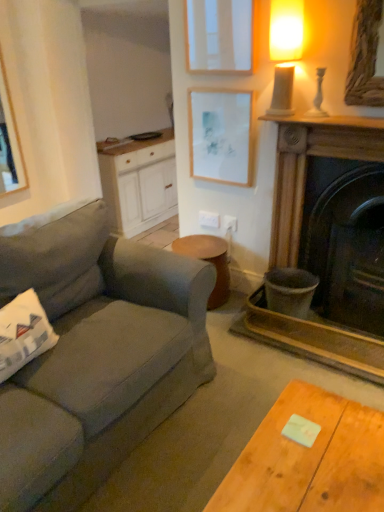
This screenshot has height=512, width=384. What do you see at coordinates (209, 219) in the screenshot?
I see `white plastic power outlet at center, the second power outlet from the right` at bounding box center [209, 219].

From the picture: In order to face white wood cabinet at center, should I rotate leftwards or rightwards?

Turn left approximately 5.364 degrees to face it.

Describe the element at coordinates (139, 183) in the screenshot. I see `white wood cabinet at center` at that location.

The width and height of the screenshot is (384, 512). What do you see at coordinates (209, 262) in the screenshot?
I see `wooden stool at center` at bounding box center [209, 262].

What is the approximate height of dark brown wood fireplace at right?

The height of dark brown wood fireplace at right is 1.08 meters.

Describe the element at coordinates (229, 223) in the screenshot. I see `white plastic power outlet at center, the second power outlet in the left-to-right sequence` at that location.

Find the location of a particular element. This screenshot has height=512, width=384. white plastic power outlet at center, marked as the first power outlet in a right-to-left arrangement is located at coordinates (229, 223).

Locate an element on the screen. Image resolution: width=384 pixels, height=512 pixels. matte white picture frame at upper center, which ranks as the 1th picture frame in bottom-to-top order is located at coordinates [220, 135].

The width and height of the screenshot is (384, 512). Describe the element at coordinates (220, 135) in the screenshot. I see `matte white picture frame at upper center, which ranks as the 1th picture frame in bottom-to-top order` at that location.

This screenshot has width=384, height=512. What are the coordinates of `matte gray fabric couch at left` in the screenshot? It's located at [101, 362].

Is white plastic power outlet at center, the second power outlet in the left-to-right sequence, looking in the opposite direction of dark brown wood fireplace at right?

white plastic power outlet at center, the second power outlet in the left-to-right sequence, is not turned away from dark brown wood fireplace at right.

From a real-world perspective, is white plastic power outlet at center, marked as the first power outlet in a right-to-left arrangement, physically below dark brown wood fireplace at right?

Yes, from a real-world perspective, white plastic power outlet at center, marked as the first power outlet in a right-to-left arrangement, is under dark brown wood fireplace at right.

Could you measure the distance between white plastic power outlet at center, marked as the first power outlet in a right-to-left arrangement, and dark brown wood fireplace at right?

They are 26.56 inches apart.

Is there a large distance between white plastic power outlet at center, marked as the first power outlet in a right-to-left arrangement, and dark brown wood fireplace at right?

No.

Consider the image. Which object is more forward, wooden stool at center or dark brown wood fireplace at right?

dark brown wood fireplace at right is more forward.

Which is in front, point (202, 256) or point (302, 164)?

The point (302, 164) is more forward.

Is there a large distance between wooden stool at center and dark brown wood fireplace at right?

That's not correct — wooden stool at center is a little close to dark brown wood fireplace at right.

In the scene shown: Looking at their sizes, would you say wooden stool at center is wider or thinner than dark brown wood fireplace at right?

In the image, wooden stool at center appears to be wider than dark brown wood fireplace at right.

From the image's perspective, is white plastic power outlet at center, marked as the first power outlet in a right-to-left arrangement, positioned above or below white plastic power outlet at center, the 1th power outlet when ordered from left to right?

white plastic power outlet at center, marked as the first power outlet in a right-to-left arrangement, is below white plastic power outlet at center, the 1th power outlet when ordered from left to right.

Considering the relative sizes of white plastic power outlet at center, marked as the first power outlet in a right-to-left arrangement, and white plastic power outlet at center, the second power outlet from the right, in the image provided, is white plastic power outlet at center, marked as the first power outlet in a right-to-left arrangement, wider than white plastic power outlet at center, the second power outlet from the right,?

Incorrect, the width of white plastic power outlet at center, marked as the first power outlet in a right-to-left arrangement, does not surpass that of white plastic power outlet at center, the second power outlet from the right.

Does white plastic power outlet at center, the second power outlet in the left-to-right sequence, have a larger size compared to white plastic power outlet at center, the 1th power outlet when ordered from left to right?

No, white plastic power outlet at center, the second power outlet in the left-to-right sequence, is not bigger than white plastic power outlet at center, the 1th power outlet when ordered from left to right.

Does white plastic power outlet at center, marked as the first power outlet in a right-to-left arrangement, appear on the right side of white plastic power outlet at center, the 1th power outlet when ordered from left to right?

Indeed, white plastic power outlet at center, marked as the first power outlet in a right-to-left arrangement, is positioned on the right side of white plastic power outlet at center, the 1th power outlet when ordered from left to right.

Can you confirm if matte gray fabric couch at left is bigger than dark brown wood fireplace at right?

Correct, matte gray fabric couch at left is larger in size than dark brown wood fireplace at right.

From the image's perspective, does matte gray fabric couch at left appear lower than dark brown wood fireplace at right?

Yes.

Is matte gray fabric couch at left with dark brown wood fireplace at right?

No.

How different are the orientations of matte gray fabric couch at left and dark brown wood fireplace at right in degrees?

90 degrees separate the facing orientations of matte gray fabric couch at left and dark brown wood fireplace at right.

Is the depth of matte white picture frame at upper center, which ranks as the 1th picture frame in bottom-to-top order, less than that of dark brown wood fireplace at right?

No, it is not.

Which is behind, point (226, 154) or point (289, 248)?

Point (226, 154)

Is dark brown wood fireplace at right at the back of matte white picture frame at upper center, which ranks as the 2th picture frame in top-to-bottom order?

No.

Who is taller, matte white picture frame at upper center, which ranks as the 2th picture frame in top-to-bottom order, or dark brown wood fireplace at right?

Standing taller between the two is dark brown wood fireplace at right.

Which is behind, point (144, 210) or point (228, 216)?

Positioned behind is point (144, 210).

Where is `the 2nd power outlet to the right of the white wood cabinet at center, starting your count from the anchor`? The width and height of the screenshot is (384, 512). the 2nd power outlet to the right of the white wood cabinet at center, starting your count from the anchor is located at coordinates (229, 223).

From a real-world perspective, relative to white plastic power outlet at center, the second power outlet in the left-to-right sequence, is white wood cabinet at center vertically above or below?

From a real-world perspective, white wood cabinet at center is physically below white plastic power outlet at center, the second power outlet in the left-to-right sequence.

In terms of height, does white wood cabinet at center look taller or shorter compared to white plastic power outlet at center, marked as the first power outlet in a right-to-left arrangement?

white wood cabinet at center is taller than white plastic power outlet at center, marked as the first power outlet in a right-to-left arrangement.

Is point (228, 284) farther from viewer compared to point (288, 45)?

Yes.

Identify the location of stool that appears behind the matte white candle at upper right. The height and width of the screenshot is (512, 384). pos(209,262).

Consider the image. From a real-world perspective, relative to matte white candle at upper right, is wooden stool at center vertically above or below?

wooden stool at center is below matte white candle at upper right.

Is wooden stool at center to the left of matte white candle at upper right from the viewer's perspective?

Yes, wooden stool at center is to the left of matte white candle at upper right.

Locate an element on the screen. Image resolution: width=384 pixels, height=512 pixels. power outlet that is the 1st object directly below the dark brown wood fireplace at right (from a real-world perspective) is located at coordinates coord(229,223).

Locate an element on the screen. This screenshot has width=384, height=512. stool below the dark brown wood fireplace at right (from the image's perspective) is located at coordinates (209, 262).

Estimate the real-world distances between objects in this image. Which object is further from matte white picture frame at upper center, which ranks as the 2th picture frame in top-to-bottom order, wooden stool at center or white matte picture frame at upper center, the first picture frame in the top-to-bottom sequence?

wooden stool at center lies further to matte white picture frame at upper center, which ranks as the 2th picture frame in top-to-bottom order, than the other object.

Looking at the image, which one is located closer to matte white candle at upper right, white matte picture frame at upper center, which is counted as the 2th picture frame, starting from the bottom, or white plastic power outlet at center, marked as the first power outlet in a right-to-left arrangement?

The object closer to matte white candle at upper right is white matte picture frame at upper center, which is counted as the 2th picture frame, starting from the bottom.

Based on the photo, estimate the real-world distances between objects in this image. Which object is closer to white wood cabinet at center, wooden stool at center or dark brown wood fireplace at right?

The object closer to white wood cabinet at center is wooden stool at center.

Estimate the real-world distances between objects in this image. Which object is further from matte white picture frame at upper center, which ranks as the 2th picture frame in top-to-bottom order, matte white candle at upper right or matte gray fabric couch at left?

The object further to matte white picture frame at upper center, which ranks as the 2th picture frame in top-to-bottom order, is matte gray fabric couch at left.

Based on their spatial positions, is white plastic power outlet at center, the 1th power outlet when ordered from left to right, or wooden stool at center further from matte white picture frame at upper center, which ranks as the 2th picture frame in top-to-bottom order?

wooden stool at center is further to matte white picture frame at upper center, which ranks as the 2th picture frame in top-to-bottom order.

Looking at the image, which one is located closer to white wood cabinet at center, dark brown wood fireplace at right or wooden stool at center?

wooden stool at center lies closer to white wood cabinet at center than the other object.

From the image, which object appears to be nearer to matte white picture frame at upper center, which ranks as the 2th picture frame in top-to-bottom order, wooden stool at center or white plastic power outlet at center, the second power outlet in the left-to-right sequence?

Among the two, white plastic power outlet at center, the second power outlet in the left-to-right sequence, is located nearer to matte white picture frame at upper center, which ranks as the 2th picture frame in top-to-bottom order.

Consider the image. Based on their spatial positions, is dark brown wood fireplace at right or matte gray fabric couch at left further from matte white picture frame at upper center, which ranks as the 2th picture frame in top-to-bottom order?

matte gray fabric couch at left lies further to matte white picture frame at upper center, which ranks as the 2th picture frame in top-to-bottom order, than the other object.

Find the location of a particular element. Image resolution: width=384 pixels, height=512 pixels. picture frame located between white matte picture frame at upper center, the first picture frame in the top-to-bottom sequence, and white wood cabinet at center in the depth direction is located at coordinates (220, 135).

At what (x,y) coordinates should I click in order to perform the action: click on stool between white matte picture frame at upper center, the first picture frame in the top-to-bottom sequence, and matte gray fabric couch at left from top to bottom. Please return your answer as a coordinate pair (x, y). The image size is (384, 512). Looking at the image, I should click on (209, 262).

I want to click on picture frame between matte white candle at upper right and wooden stool at center vertically, so click(x=220, y=135).

Where is `lamp between white matte picture frame at upper center, which is counted as the 2th picture frame, starting from the bottom, and white plastic power outlet at center, marked as the first power outlet in a right-to-left arrangement, from top to bottom`? lamp between white matte picture frame at upper center, which is counted as the 2th picture frame, starting from the bottom, and white plastic power outlet at center, marked as the first power outlet in a right-to-left arrangement, from top to bottom is located at coordinates (285, 51).